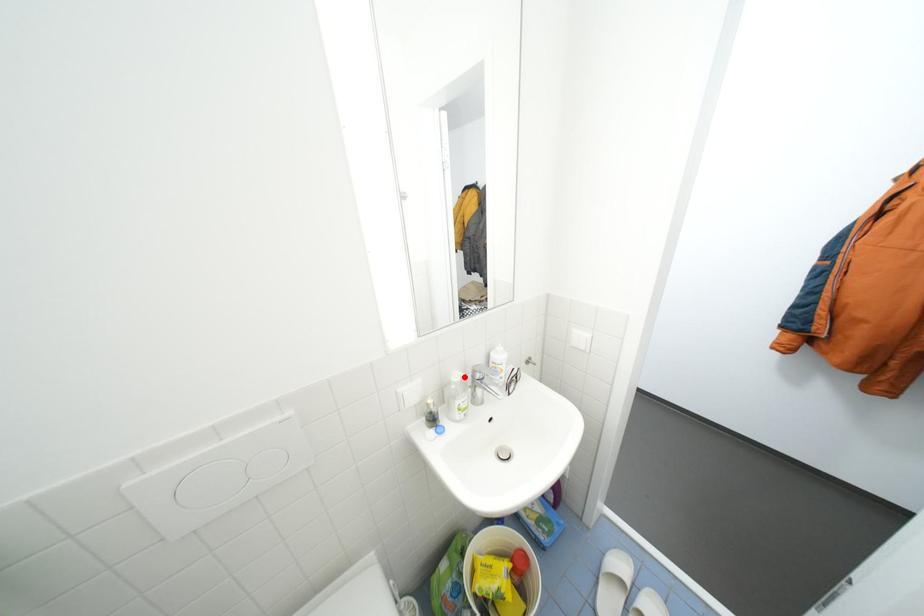
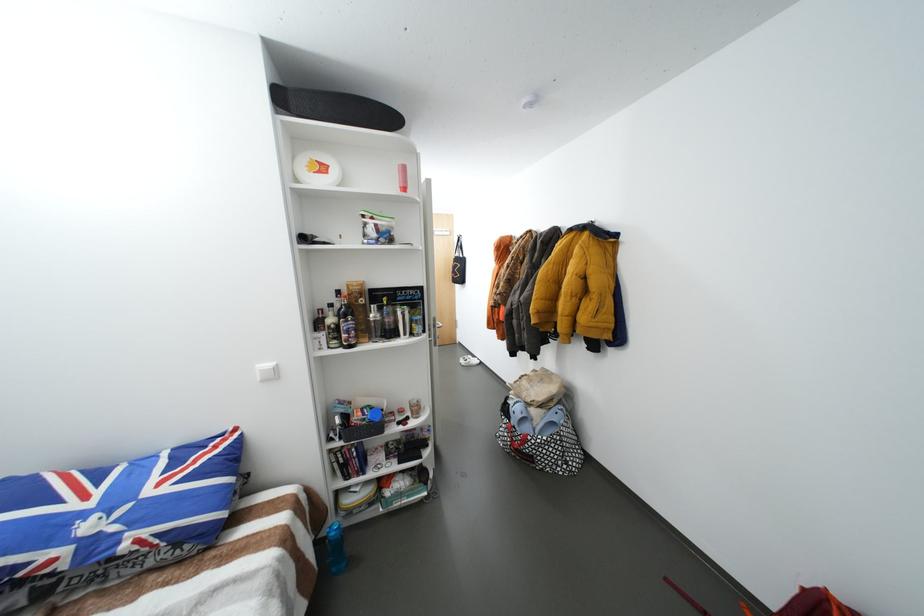
Question: I am providing you with two images of the same scene from different viewpoints. A red point is marked on the first image. At the location where the point appears in image 1, is it still visible in image 2?

Choices:
 (A) Yes
 (B) No

Answer: (B)